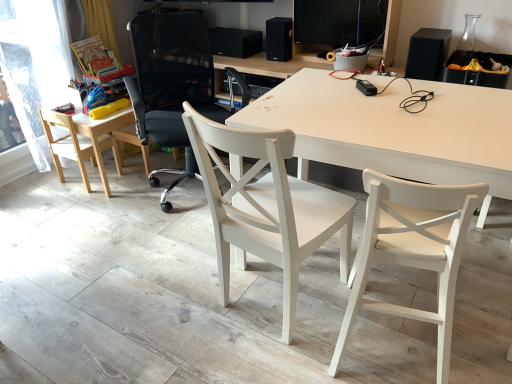
Where is `vacant space underneath white wood chair at center, placed as the 2th chair when sorted from right to left (from a real-world perspective)`? vacant space underneath white wood chair at center, placed as the 2th chair when sorted from right to left (from a real-world perspective) is located at coordinates (264, 301).